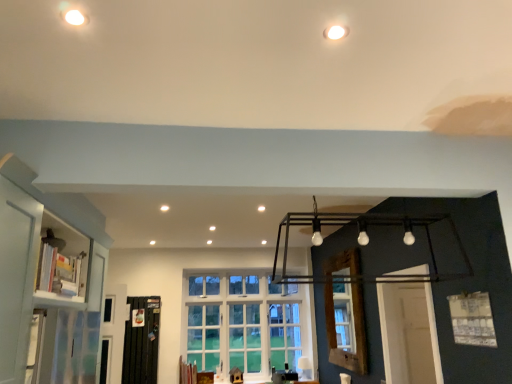
The width and height of the screenshot is (512, 384). Describe the element at coordinates (62, 260) in the screenshot. I see `white glossy bookshelf at left` at that location.

You are a GUI agent. You are given a task and a screenshot of the screen. Output one action in this format:
    pyautogui.click(x=<x>, y=<y>)
    Task: Click on the white matte window at upper center, which appears as the first window when viewed from the front
    
    Given the screenshot: What is the action you would take?
    pyautogui.click(x=472, y=319)

What do you see at coordinates (46, 294) in the screenshot?
I see `white glossy bookshelf at left` at bounding box center [46, 294].

Measure the distance between point (349, 269) and camera.

They are 13.42 feet apart.

Find the location of a particular element. white glossy bookshelf at left is located at coordinates (62, 260).

Is black metal screen door at lower left at the left side of white matte window at upper center, placed as the 2th window when sorted from left to right?

Yes.

From the image's perspective, is black metal screen door at lower left positioned above or below white matte window at upper center, which ranks as the 2th window in back-to-front order?

Based on their image positions, black metal screen door at lower left is located beneath white matte window at upper center, which ranks as the 2th window in back-to-front order.

At what (x,y) coordinates should I click in order to perform the action: click on screen door directly beneath the white matte window at upper center, placed as the 2th window when sorted from left to right (from a real-world perspective). Please return your answer as a coordinate pair (x, y). The width and height of the screenshot is (512, 384). Looking at the image, I should click on (141, 342).

Are black metal screen door at lower left and white matte window at upper center, arranged as the first window when viewed from the right, located far from each other?

Yes, black metal screen door at lower left and white matte window at upper center, arranged as the first window when viewed from the right, are quite far apart.

Is white matte window at upper center, which appears as the first window when viewed from the front, taller than white glossy bookshelf at left?

No, white matte window at upper center, which appears as the first window when viewed from the front, is not taller than white glossy bookshelf at left.

From the picture: Based on their positions, is white matte window at upper center, which is the 2th window in bottom-to-top order, located to the left or right of white glossy bookshelf at left?

white matte window at upper center, which is the 2th window in bottom-to-top order, is to the right of white glossy bookshelf at left.

I want to click on window that is the 1st one when counting downward from the white glossy bookshelf at left (from the image's perspective), so click(472, 319).

From a real-world perspective, is white glossy bookshelf at left positioned over white glass window at center, which is the second window in front-to-back order, based on gravity?

Yes, from a real-world perspective, white glossy bookshelf at left is on top of white glass window at center, which is the second window in front-to-back order.

Based on their positions, is white glossy bookshelf at left located to the left or right of white glass window at center, which is the 1th window in bottom-to-top order?

white glossy bookshelf at left is to the left of white glass window at center, which is the 1th window in bottom-to-top order.

How different are the orientations of white glossy bookshelf at left and white glass window at center, which is the 2th window in right-to-left order, in degrees?

90.5 degrees.

Based on the photo, from the image's perspective, which is above, white glossy bookshelf at left or white glass window at center, the 1th window when ordered from back to front?

white glossy bookshelf at left appears higher in the image.

From the image's perspective, between white matte window at upper center, which is the 2th window in bottom-to-top order, and white glossy bookshelf at left, who is located below?

From the image's view, white matte window at upper center, which is the 2th window in bottom-to-top order, is below.

Between white matte window at upper center, placed as the 2th window when sorted from left to right, and white glossy bookshelf at left, which one appears on the right side from the viewer's perspective?

From the viewer's perspective, white matte window at upper center, placed as the 2th window when sorted from left to right, appears more on the right side.

From the image's perspective, count 1st windows downward from the white glossy bookshelf at left and point to it. Please provide its 2D coordinates.

[(472, 319)]

Which of these two, black metal screen door at lower left or white glossy bookshelf at left, stands shorter?

Standing shorter between the two is black metal screen door at lower left.

Between black metal screen door at lower left and white glossy bookshelf at left, which one appears on the right side from the viewer's perspective?

white glossy bookshelf at left is more to the right.

From a real-world perspective, which object stands above the other?

white glossy bookshelf at left, from a real-world perspective.

How many degrees apart are the facing directions of white glossy bookshelf at left and white glass window at center, which is the 1th window in bottom-to-top order?

There is a 88.9-degree angle between the facing directions of white glossy bookshelf at left and white glass window at center, which is the 1th window in bottom-to-top order.

From a real-world perspective, is white glossy bookshelf at left positioned over white glass window at center, which is the 2th window in right-to-left order, based on gravity?

Yes, from a real-world perspective, white glossy bookshelf at left is on top of white glass window at center, which is the 2th window in right-to-left order.

Considering the positions of objects white glossy bookshelf at left and white glass window at center, marked as the second window in a top-to-bottom arrangement, in the image provided, who is more to the left, white glossy bookshelf at left or white glass window at center, marked as the second window in a top-to-bottom arrangement,?

Positioned to the left is white glossy bookshelf at left.

Which object is more forward, white glossy bookshelf at left or white glass window at center, the first window in the left-to-right sequence?

white glossy bookshelf at left.

Is white glossy bookshelf at left in front of or behind white glossy bookshelf at left in the image?

In the image, white glossy bookshelf at left appears behind white glossy bookshelf at left.

Is white glossy bookshelf at left looking in the opposite direction of white glossy bookshelf at left?

Yes, white glossy bookshelf at left is facing away from white glossy bookshelf at left.

Where is `shelf on the right of white glossy bookshelf at left`? shelf on the right of white glossy bookshelf at left is located at coordinates (62, 260).

Looking at this image, is white glossy bookshelf at left in contact with white glossy bookshelf at left?

They are not placed beside each other.

Where is `screen door lying below the white matte window at upper center, which ranks as the 2th window in back-to-front order (from the image's perspective)`? Image resolution: width=512 pixels, height=384 pixels. screen door lying below the white matte window at upper center, which ranks as the 2th window in back-to-front order (from the image's perspective) is located at coordinates (141, 342).

In the image, there is a white matte window at upper center, which is the 2th window in bottom-to-top order. Identify the location of shelf above it (from the image's perspective). Image resolution: width=512 pixels, height=384 pixels. (62, 260).

From the image, which object appears to be farther from wooden window frame at center, black metal screen door at lower left or white glass window at center, the first window in the left-to-right sequence?

black metal screen door at lower left lies further to wooden window frame at center than the other object.

Looking at the image, which one is located further to white glossy bookshelf at left, wooden window frame at center or white matte window at upper center, which ranks as the 2th window in back-to-front order?

wooden window frame at center lies further to white glossy bookshelf at left than the other object.

Considering their positions, is wooden window frame at center positioned further to white glossy bookshelf at left than black metal screen door at lower left?

wooden window frame at center lies further to white glossy bookshelf at left than the other object.

Estimate the real-world distances between objects in this image. Which object is further from white matte window at upper center, placed as the 2th window when sorted from left to right, white glossy bookshelf at left or wooden window frame at center?

Based on the image, white glossy bookshelf at left appears to be further to white matte window at upper center, placed as the 2th window when sorted from left to right.

Looking at the image, which one is located further to white glossy bookshelf at left, wooden window frame at center or white glossy bookshelf at left?

wooden window frame at center lies further to white glossy bookshelf at left than the other object.

Based on their spatial positions, is white matte window at upper center, which ranks as the 2th window in back-to-front order, or wooden window frame at center further from white glossy bookshelf at left?

wooden window frame at center is positioned further to the anchor white glossy bookshelf at left.

From the image, which object appears to be nearer to white matte window at upper center, which is the first window from top to bottom, black metal screen door at lower left or white glossy bookshelf at left?

white glossy bookshelf at left is closer to white matte window at upper center, which is the first window from top to bottom.

Based on their spatial positions, is wooden window frame at center or white matte window at upper center, which is the 2th window in bottom-to-top order, closer to white glossy bookshelf at left?

white matte window at upper center, which is the 2th window in bottom-to-top order, is closer to white glossy bookshelf at left.

In order to click on screen door located between white glossy bookshelf at left and white glass window at center, which is the 1th window in bottom-to-top order, in the depth direction in this screenshot , I will do `click(141, 342)`.

The height and width of the screenshot is (384, 512). I want to click on window frame between white glossy bookshelf at left and white matte window at upper center, arranged as the first window when viewed from the right, so click(345, 312).

At what (x,y) coordinates should I click in order to perform the action: click on window frame between white glossy bookshelf at left and black metal screen door at lower left along the z-axis. Please return your answer as a coordinate pair (x, y). This screenshot has height=384, width=512. Looking at the image, I should click on (345, 312).

Find the location of `window between white glossy bookshelf at left and white glass window at center, marked as the second window in a top-to-bottom arrangement, along the z-axis`. window between white glossy bookshelf at left and white glass window at center, marked as the second window in a top-to-bottom arrangement, along the z-axis is located at coordinates (472, 319).